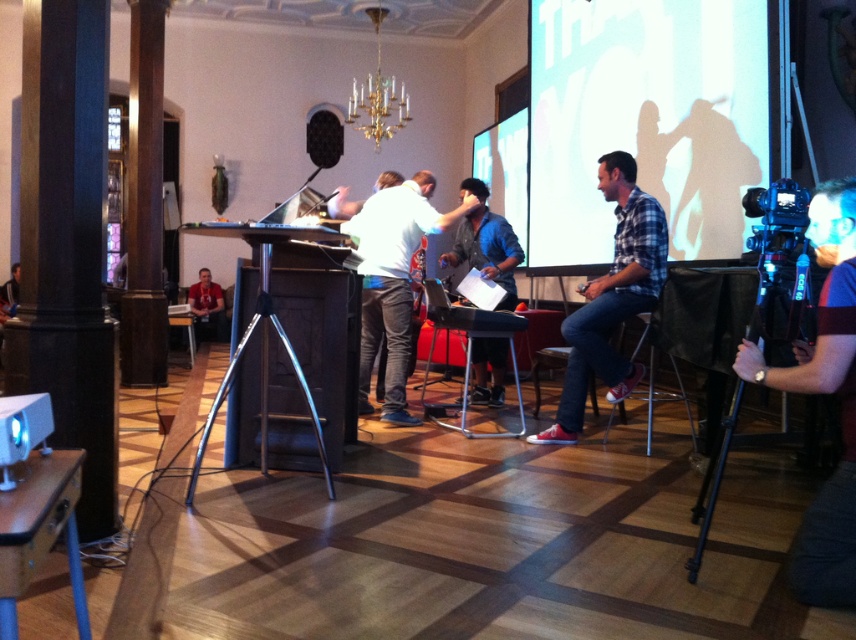
Who is more forward, (486, 352) or (325, 118)?

Positioned in front is point (486, 352).

Can you confirm if denim shirt at center is positioned above black matte speaker at center?

No.

You are a GUI agent. You are given a task and a screenshot of the screen. Output one action in this format:
    pyautogui.click(x=<x>, y=<y>)
    Task: Click on the denim shirt at center
    The width and height of the screenshot is (856, 640).
    Given the screenshot: What is the action you would take?
    pyautogui.click(x=485, y=243)

The image size is (856, 640). What are the coordinates of `denim shirt at center` in the screenshot? It's located at (485, 243).

Is point (702, 54) positioned before point (491, 340)?

Yes.

Can you confirm if white matte projection screen at upper right is wider than denim shirt at center?

Yes, white matte projection screen at upper right is wider than denim shirt at center.

Image resolution: width=856 pixels, height=640 pixels. Find the location of `white matte projection screen at upper right`. white matte projection screen at upper right is located at coordinates (646, 120).

Does blue fabric camera at right appear on the right side of denim shirt at center?

Correct, you'll find blue fabric camera at right to the right of denim shirt at center.

Is blue fabric camera at right shorter than denim shirt at center?

Incorrect, blue fabric camera at right's height does not fall short of denim shirt at center's.

Is point (843, 596) positioned behind point (447, 252)?

No.

Where is `blue fabric camera at right`? The height and width of the screenshot is (640, 856). blue fabric camera at right is located at coordinates (824, 392).